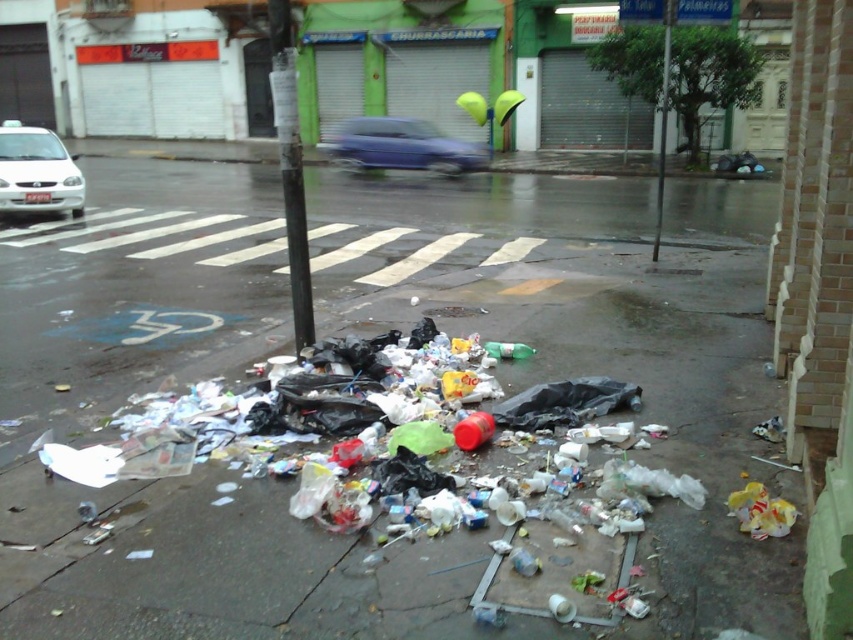
Looking at this image, is blue glossy car at center taller than white matte car at left?

No.

Measure the distance between blue glossy car at center and camera.

They are 21.21 meters apart.

The width and height of the screenshot is (853, 640). I want to click on blue glossy car at center, so click(401, 147).

Does shiny plastic trash at center appear on the right side of black metal pole at center?

Indeed, shiny plastic trash at center is positioned on the right side of black metal pole at center.

Which is behind, point (561, 340) or point (285, 115)?

The point (561, 340) is more distant.

You are a GUI agent. You are given a task and a screenshot of the screen. Output one action in this format:
    pyautogui.click(x=<x>, y=<y>)
    Task: Click on the shiny plastic trash at center
    This screenshot has height=640, width=853.
    Given the screenshot: What is the action you would take?
    pyautogui.click(x=604, y=342)

Is point (297, 248) farther from viewer compared to point (428, 157)?

No, (297, 248) is in front of (428, 157).

Who is more forward, (287,28) or (397,152)?

Point (287,28) is more forward.

Where is `black metal pole at center`? black metal pole at center is located at coordinates (289, 168).

Locate an element on the screen. black metal pole at center is located at coordinates (289, 168).